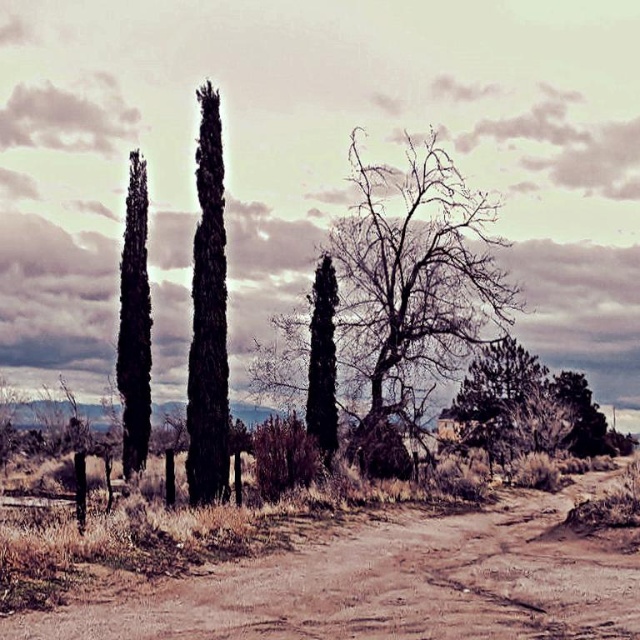
Which is below, brown sandy dirt at center or green textured bush at right?

brown sandy dirt at center is below.

Between point (516, 600) and point (564, 372), which one is positioned behind?

Point (564, 372)

At what (x,y) coordinates should I click in order to perform the action: click on brown sandy dirt at center. Please return your answer as a coordinate pair (x, y). This screenshot has width=640, height=640. Looking at the image, I should click on (394, 582).

Does dark green textured cypress tree at center come behind dark green textured cypress tree at left?

No, dark green textured cypress tree at center is closer to the viewer.

Can you confirm if dark green textured cypress tree at center is bigger than dark green textured cypress tree at left?

Yes.

The width and height of the screenshot is (640, 640). What do you see at coordinates (209, 317) in the screenshot?
I see `dark green textured cypress tree at center` at bounding box center [209, 317].

Identify the location of dark green textured cypress tree at center. (209, 317).

The image size is (640, 640). I want to click on dark green textured cypress tree at center, so click(x=209, y=317).

This screenshot has width=640, height=640. Describe the element at coordinates (209, 317) in the screenshot. I see `dark green textured cypress tree at center` at that location.

Locate an element on the screen. This screenshot has width=640, height=640. dark green textured cypress tree at center is located at coordinates (209, 317).